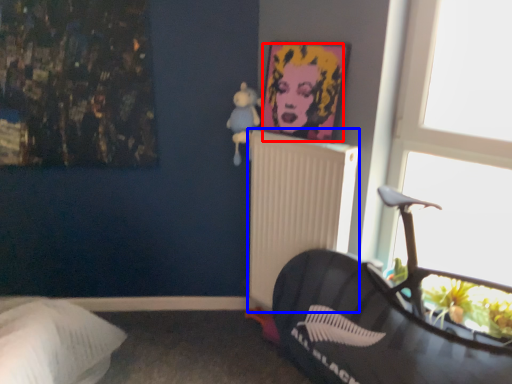
Question: Which point is further to the camera, person (highlighted by a red box) or radiator (highlighted by a blue box)?

Choices:
 (A) person
 (B) radiator

Answer: (B)